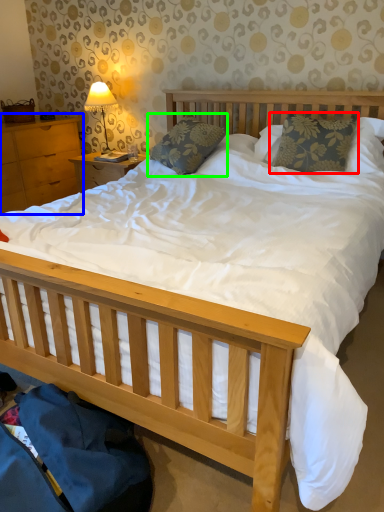
Question: Which object is positioned closest to pillow (highlighted by a red box)? Select from nightstand (highlighted by a blue box) and pillow (highlighted by a green box).

Choices:
 (A) nightstand
 (B) pillow

Answer: (B)